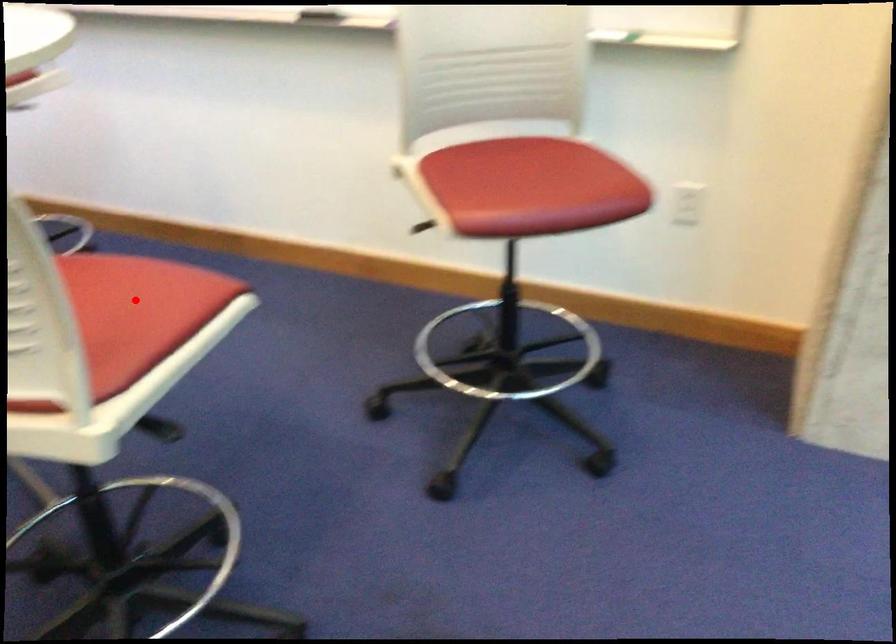
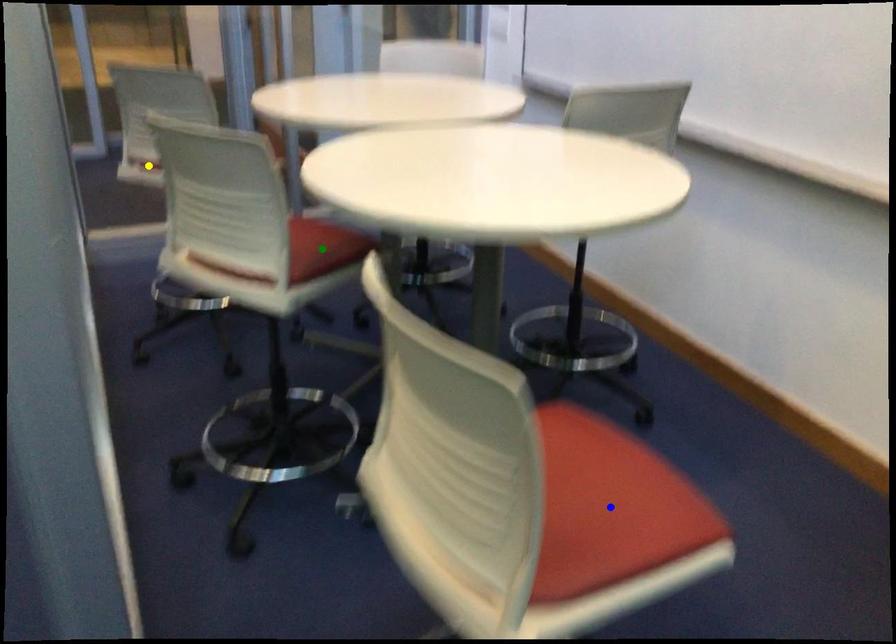
Question: I am providing you with two images of the same scene from different viewpoints. A red point is marked on the first image. You are given multiple points on the second image. Which point in image 2 is actually the same real-world point as the red point in image 1?

Choices:
 (A) green point
 (B) yellow point
 (C) blue point

Answer: (C)